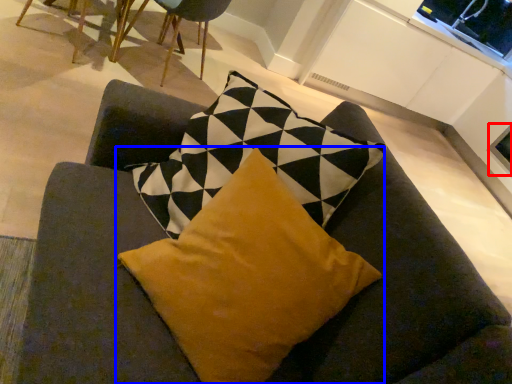
Question: Among these objects, which one is farthest to the camera, window screen (highlighted by a red box) or pillow (highlighted by a blue box)?

Choices:
 (A) window screen
 (B) pillow

Answer: (A)